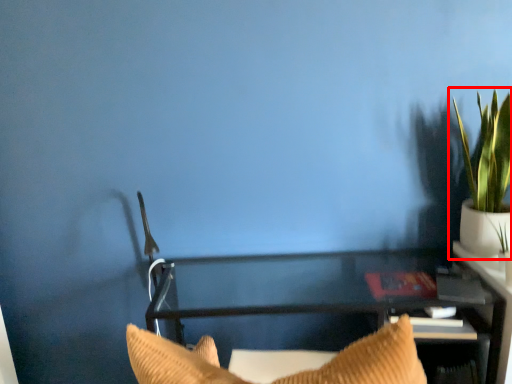
Question: From the image's perspective, considering the relative positions of houseplant (annotated by the red box) and furniture in the image provided, where is houseplant (annotated by the red box) located with respect to the staircase?

Choices:
 (A) below
 (B) above

Answer: (B)